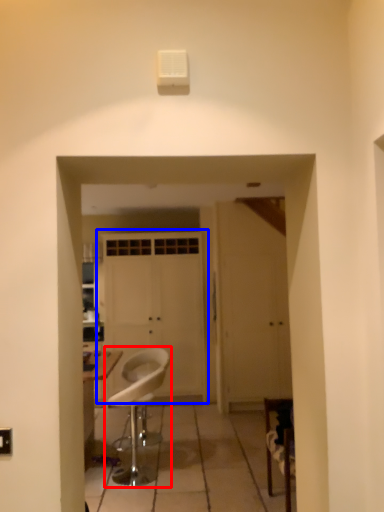
Question: Among these objects, which one is farthest to the camera, chair (highlighted by a red box) or door (highlighted by a blue box)?

Choices:
 (A) chair
 (B) door

Answer: (B)